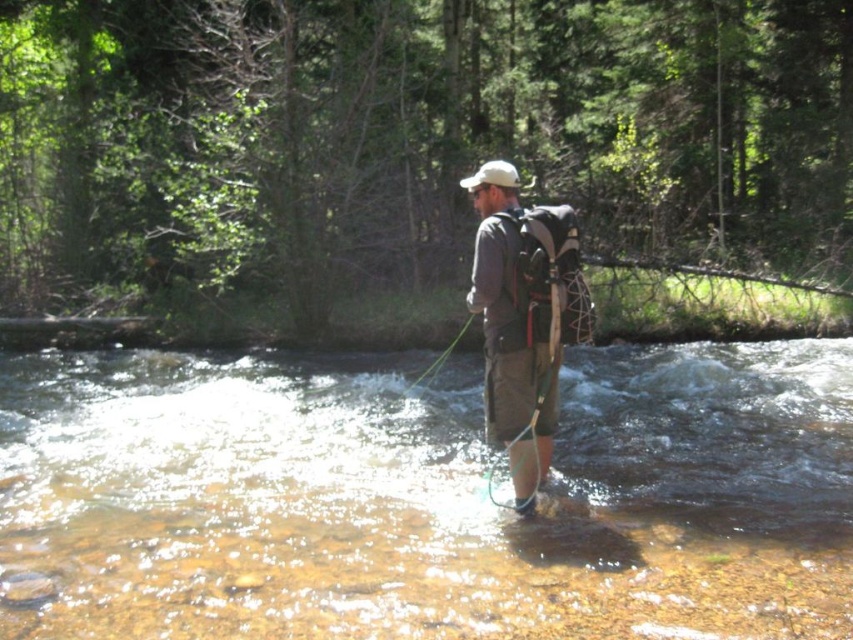
You are a hiker who wants to cross the river using the clear water at center and the gray fabric backpack at center. Which object is shorter in height?

The clear water at center is not as tall as the gray fabric backpack at center, so the clear water at center is shorter in height.

You are a hiker who wants to retrieve your gray fabric backpack at center from the clear water at center. Can you reach it without getting your feet wet?

The clear water at center is below the gray fabric backpack at center, so the backpack is not submerged in the water. You can reach it without getting your feet wet.

You are the fisherman in the scene. You want to place your gray fabric backpack at center on the riverbank to avoid it getting wet. However, you notice the clear water at center is flowing towards your backpack. Which direction should you move your backpack to keep it dry?

The clear water at center is to the right of gray fabric backpack at center. To keep the backpack dry, move it to the left side away from the flowing water.